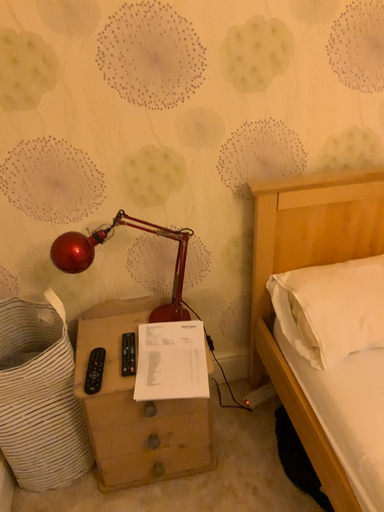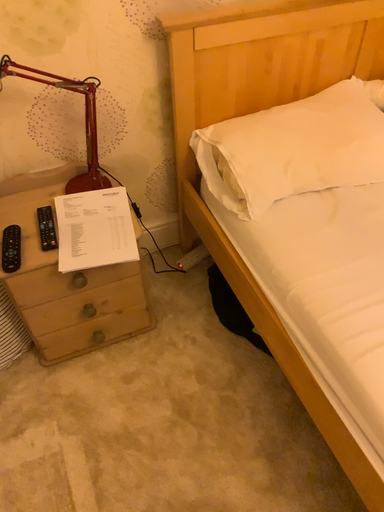
Question: How did the camera likely rotate when shooting the video?

Choices:
 (A) rotated right
 (B) rotated left

Answer: (A)